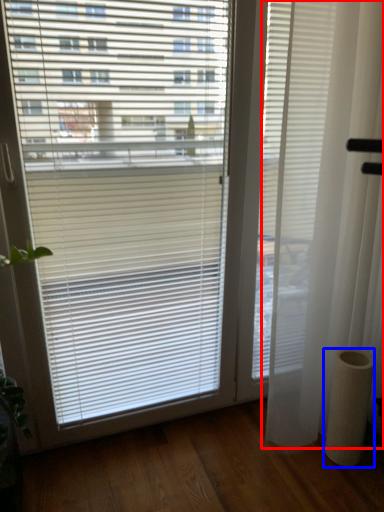
Question: Which object appears closest to the camera in this image, curtain (highlighted by a red box) or pillar (highlighted by a blue box)?

Choices:
 (A) curtain
 (B) pillar

Answer: (A)